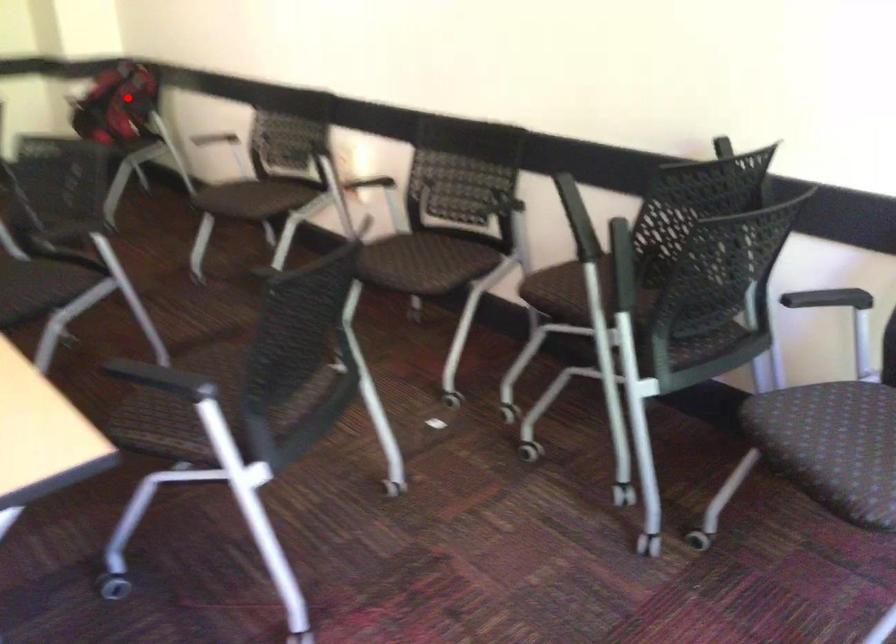
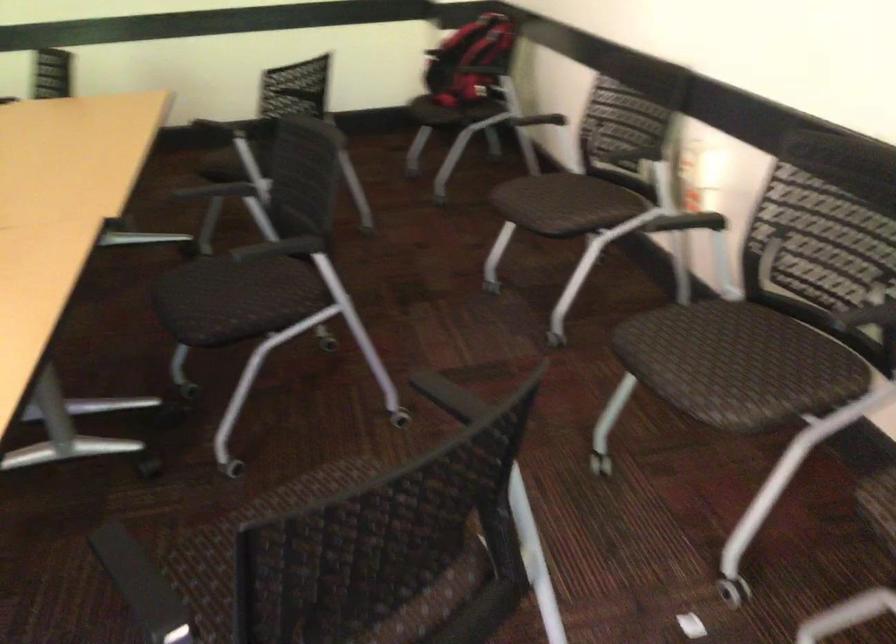
Locate, in the second image, the point that corresponds to the highlighted location in the first image.

(471, 61)